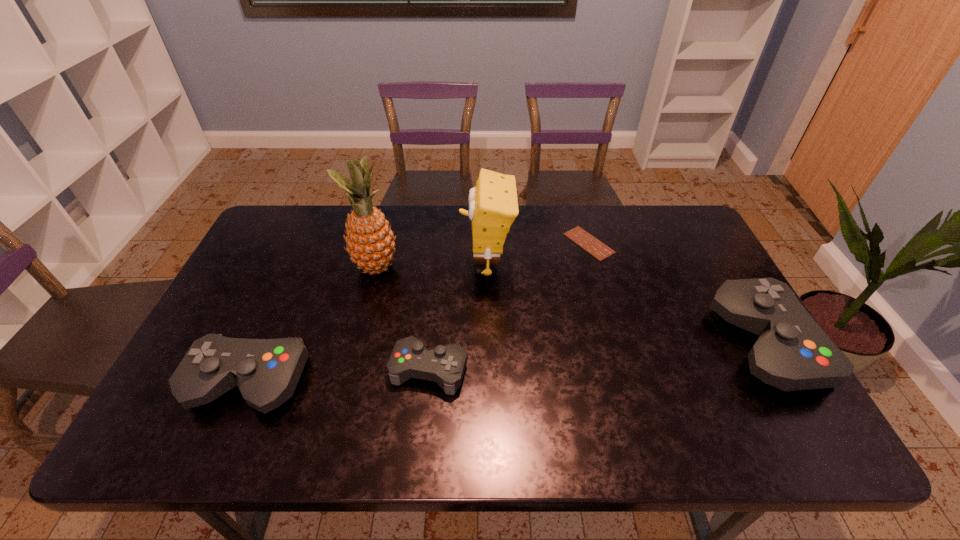
This screenshot has width=960, height=540. What are the coordinates of `object that is at the left edge` in the screenshot? It's located at (266, 371).

Locate an element on the screen. This screenshot has width=960, height=540. object situated at the right edge is located at coordinates (792, 353).

Identify the location of object present at the near left corner. (266, 371).

The image size is (960, 540). Find the location of `object at the near right corner`. object at the near right corner is located at coordinates (792, 353).

The image size is (960, 540). Identify the location of vacant space at the far edge of the desktop. [x=544, y=231].

Locate an element on the screen. This screenshot has width=960, height=540. vacant area at the near edge is located at coordinates [321, 379].

In the image, there is a desktop. Where is `blank space at the left edge`? This screenshot has height=540, width=960. blank space at the left edge is located at coordinates (300, 253).

In the image, there is a desktop. Where is `free space at the right edge`? free space at the right edge is located at coordinates (716, 294).

Image resolution: width=960 pixels, height=540 pixels. I want to click on vacant space at the far left corner of the desktop, so click(x=280, y=226).

Where is `vacant region between the second tallest object and the second control from left to right`? vacant region between the second tallest object and the second control from left to right is located at coordinates (458, 316).